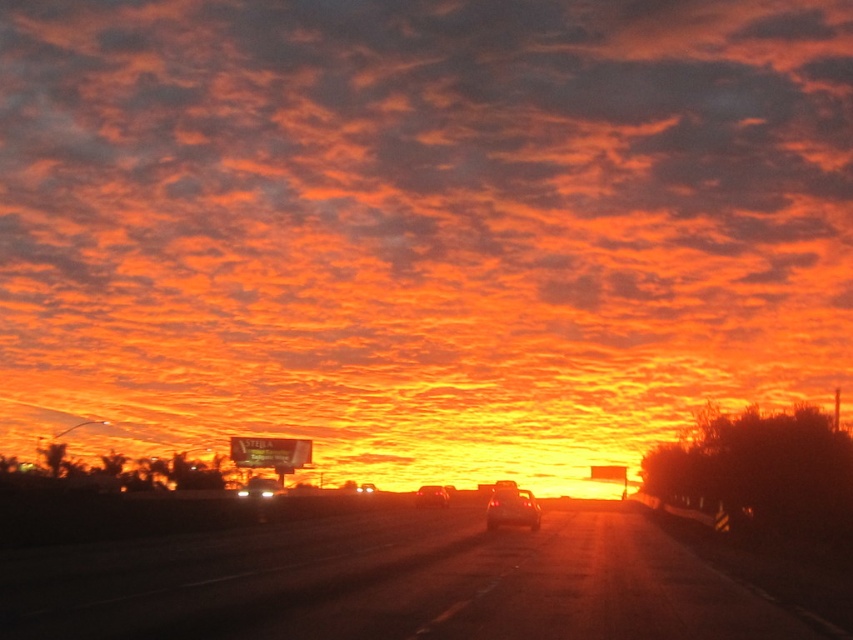
Does shiny metallic car at center have a lesser height compared to shiny silver sedan at center?

Yes.

Who is positioned more to the left, shiny metallic car at center or shiny silver sedan at center?

shiny silver sedan at center is more to the left.

At what (x,y) coordinates should I click in order to perform the action: click on shiny metallic car at center. Please return your answer as a coordinate pair (x, y). Looking at the image, I should click on (512, 509).

Does smooth asphalt highway at center appear under shiny silver sedan at center?

Incorrect, smooth asphalt highway at center is not positioned below shiny silver sedan at center.

Does smooth asphalt highway at center appear over shiny silver sedan at center?

Correct, smooth asphalt highway at center is located above shiny silver sedan at center.

Who is more distant from viewer, (505,584) or (424,504)?

The point (424,504) is behind.

Where is `smooth asphalt highway at center`? smooth asphalt highway at center is located at coordinates (395, 582).

Is point (86, 554) positioned behind point (502, 518)?

No, it is in front of (502, 518).

Does smooth asphalt highway at center have a smaller size compared to shiny metallic car at center?

No, smooth asphalt highway at center is not smaller than shiny metallic car at center.

Image resolution: width=853 pixels, height=640 pixels. Describe the element at coordinates (395, 582) in the screenshot. I see `smooth asphalt highway at center` at that location.

This screenshot has height=640, width=853. I want to click on smooth asphalt highway at center, so click(395, 582).